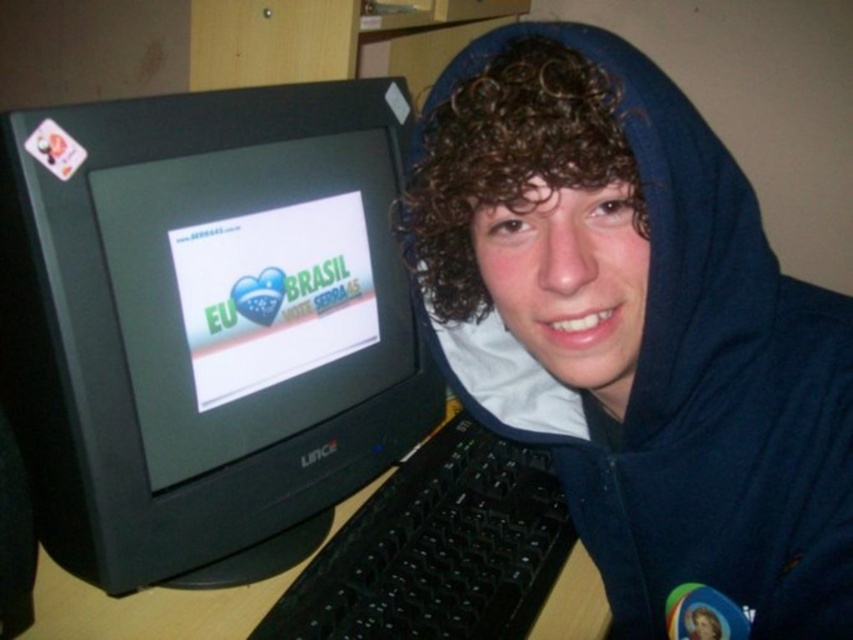
Is black plastic monitor at left smaller than blue fleece hoodie at center?

Incorrect, black plastic monitor at left is not smaller in size than blue fleece hoodie at center.

Who is more forward, (285, 240) or (543, 52)?

Point (543, 52)

Locate an element on the screen. black plastic monitor at left is located at coordinates (206, 323).

Who is more distant from viewer, (642,140) or (233,621)?

The point (233,621) is behind.

How far apart are blue fleece hoodie at center and wooden at left?

They are 15.31 inches apart.

Is point (614, 198) in front of point (235, 600)?

Yes, point (614, 198) is closer to viewer.

Where is `blue fleece hoodie at center`? This screenshot has height=640, width=853. blue fleece hoodie at center is located at coordinates (548, 216).

Which is more to the right, black plastic monitor at left or wooden at left?

wooden at left

Between point (262, 220) and point (196, 589), which one is positioned behind?

Point (196, 589)

The height and width of the screenshot is (640, 853). I want to click on black plastic monitor at left, so click(x=206, y=323).